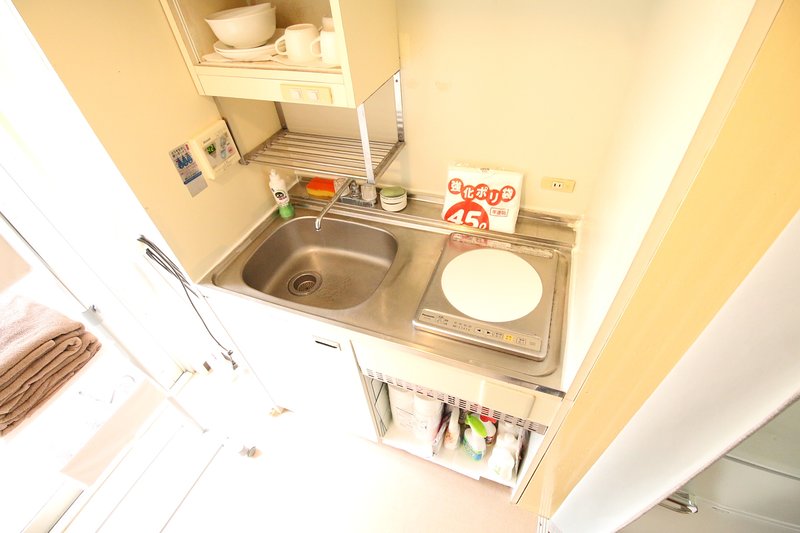
This screenshot has height=533, width=800. I want to click on yellow wall, so click(633, 387).